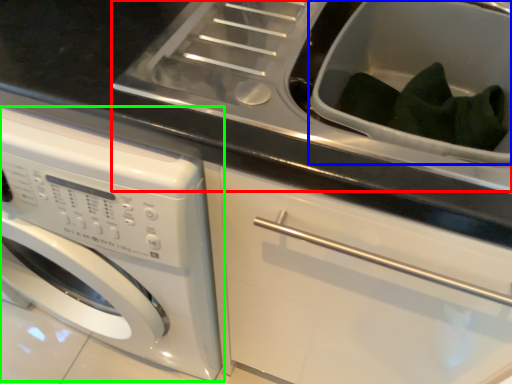
Question: Which object is the closest to the sink (highlighted by a red box)? Choose among these: sink (highlighted by a blue box) or washing machine (highlighted by a green box).

Choices:
 (A) sink
 (B) washing machine

Answer: (A)